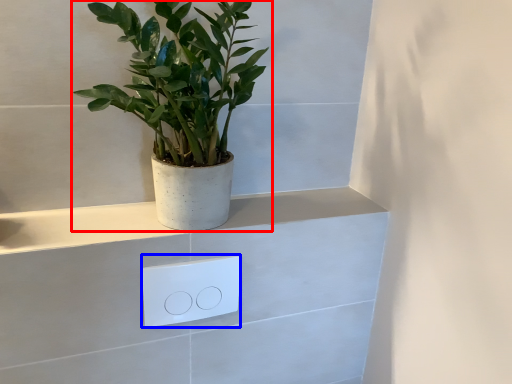
Question: Which object appears farthest to the camera in this image, houseplant (highlighted by a red box) or light switch (highlighted by a blue box)?

Choices:
 (A) houseplant
 (B) light switch

Answer: (B)